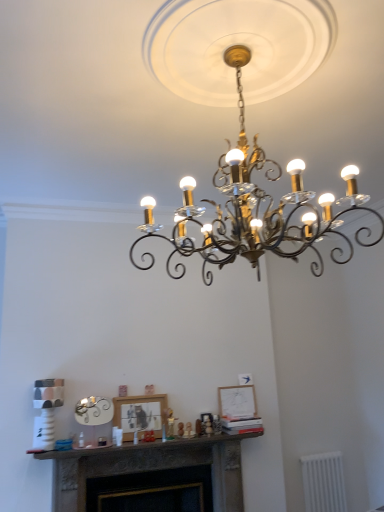
Question: Does point (332, 497) appear closer or farther from the camera than point (117, 406)?

Choices:
 (A) farther
 (B) closer

Answer: (A)

Question: Considering the positions of white plastic radiator at lower right and matte black picture frame at center, the 1th picture frame positioned from the left, in the image, is white plastic radiator at lower right wider or thinner than matte black picture frame at center, the 1th picture frame positioned from the left,?

Choices:
 (A) wide
 (B) thin

Answer: (B)

Question: Considering the real-world distances, which object is farthest from the white plastic radiator at lower right?

Choices:
 (A) matte white picture frame at center, which appears as the 1th picture frame when viewed from the right
 (B) dark gray stone fireplace at center
 (C) black wrought iron chandelier at center
 (D) matte black picture frame at center, marked as the 1th picture frame in a front-to-back arrangement

Answer: (C)

Question: Which of these objects is positioned closest to the black wrought iron chandelier at center?

Choices:
 (A) dark gray stone fireplace at center
 (B) matte white picture frame at center, which appears as the 1th picture frame when viewed from the right
 (C) white plastic radiator at lower right
 (D) matte black picture frame at center, positioned as the second picture frame in back-to-front order

Answer: (D)